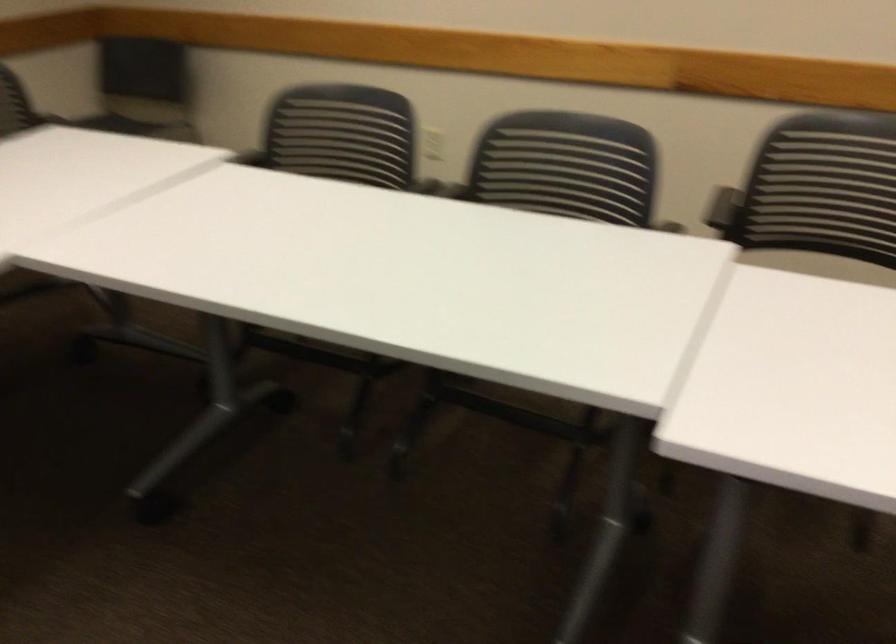
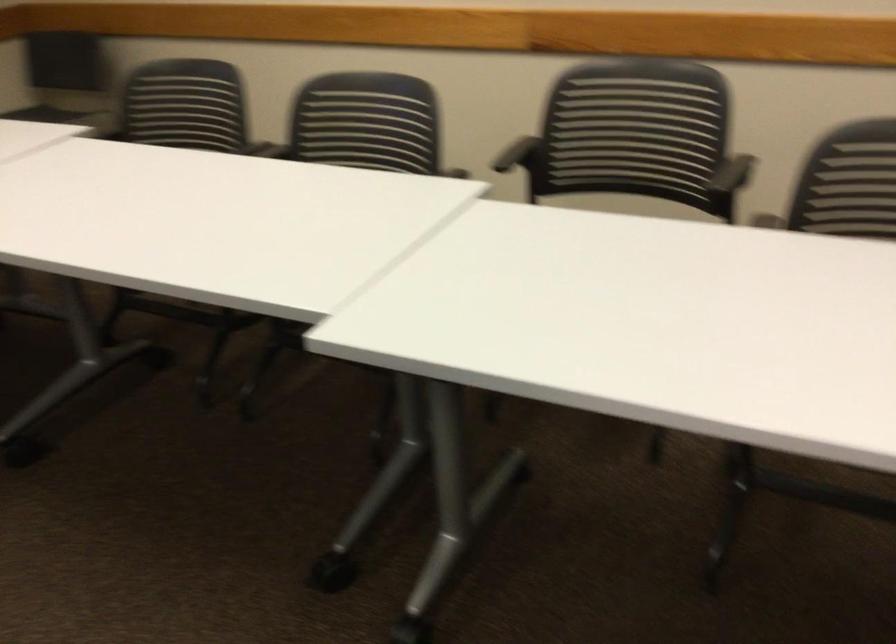
In a continuous first-person perspective shot, in which direction is the camera moving?

The cameraman moved toward right, backward.